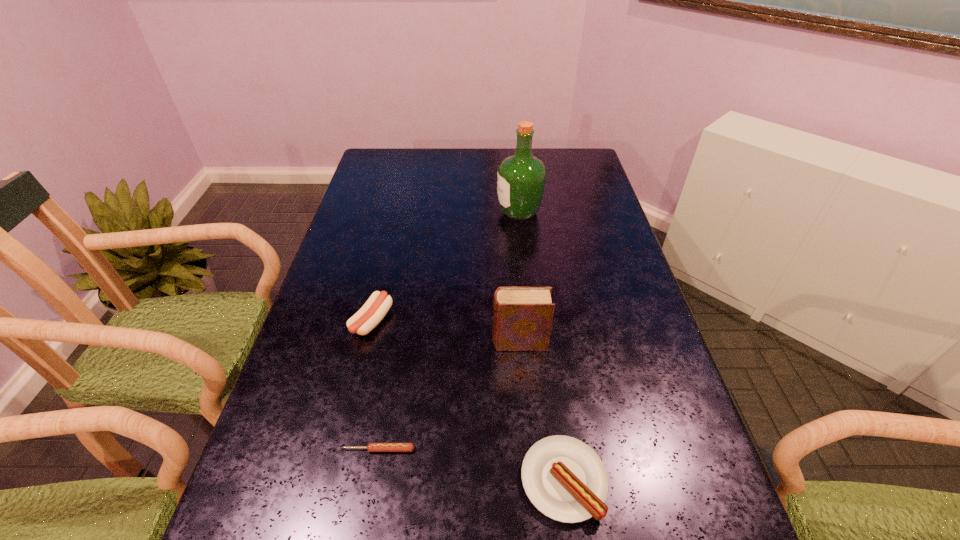
Find the location of a particular element. vacant point that satisfies the following two spatial constraints: 1. on the front-facing side of the liquor; 2. on the back side of the second shortest sausage is located at coordinates (549, 480).

The width and height of the screenshot is (960, 540). Find the location of `vacant region that satisfies the following two spatial constraints: 1. on the spine side of the fourth shortest object; 2. on the left side of the second shortest object`. vacant region that satisfies the following two spatial constraints: 1. on the spine side of the fourth shortest object; 2. on the left side of the second shortest object is located at coordinates tap(530, 480).